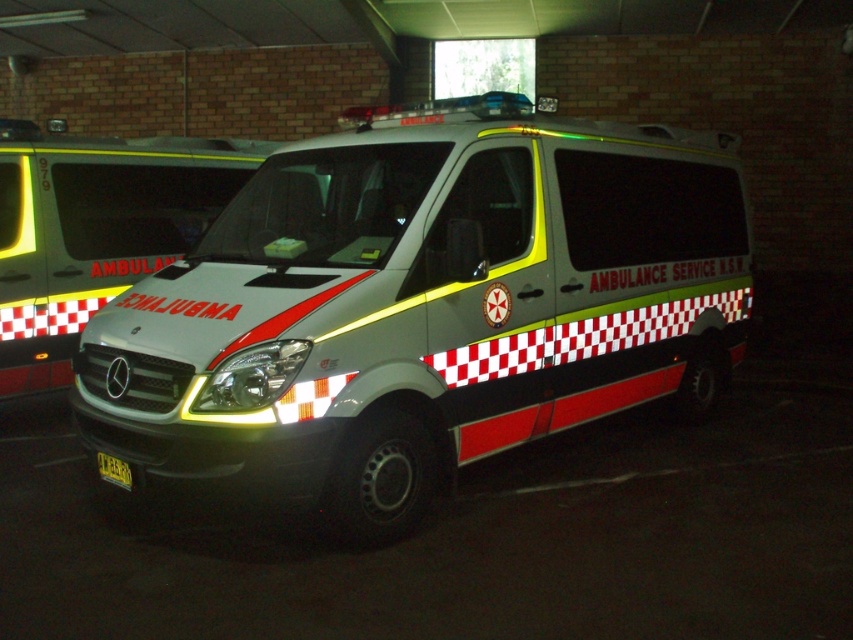
Describe the element at coordinates (422, 308) in the screenshot. I see `matte gray ambulance at center` at that location.

Between matte gray ambulance at center and white glossy ambulance at center, which one has more height?

Standing taller between the two is matte gray ambulance at center.

You are a GUI agent. You are given a task and a screenshot of the screen. Output one action in this format:
    pyautogui.click(x=<x>, y=<y>)
    Task: Click on the matte gray ambulance at center
    
    Given the screenshot: What is the action you would take?
    pyautogui.click(x=422, y=308)